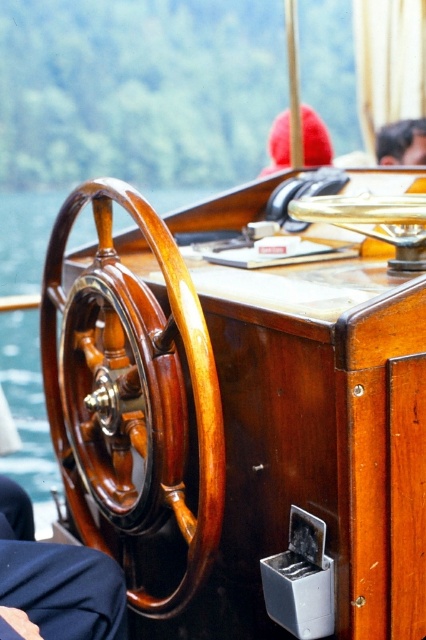
Question: Can you confirm if red woolen hat at center is positioned above wooden at center?

Choices:
 (A) yes
 (B) no

Answer: (A)

Question: Estimate the real-world distances between objects in this image. Which object is closer to the dark blue fabric at lower left?

Choices:
 (A) shiny brown wood steering wheel at left
 (B) red woolen hat at center
 (C) wooden at center
 (D) brown leather hat at upper center

Answer: (A)

Question: Does shiny brown wood steering wheel at left have a smaller size compared to dark blue fabric at lower left?

Choices:
 (A) no
 (B) yes

Answer: (A)

Question: Among these points, which one is farthest from the camera?

Choices:
 (A) (385, 156)
 (B) (137, 349)

Answer: (A)

Question: Among these points, which one is farthest from the camera?

Choices:
 (A) (115, 579)
 (B) (412, 124)
 (C) (293, 186)

Answer: (B)

Question: Observing the image, what is the correct spatial positioning of dark blue fabric at lower left in reference to brown leather hat at upper center?

Choices:
 (A) right
 (B) left

Answer: (B)